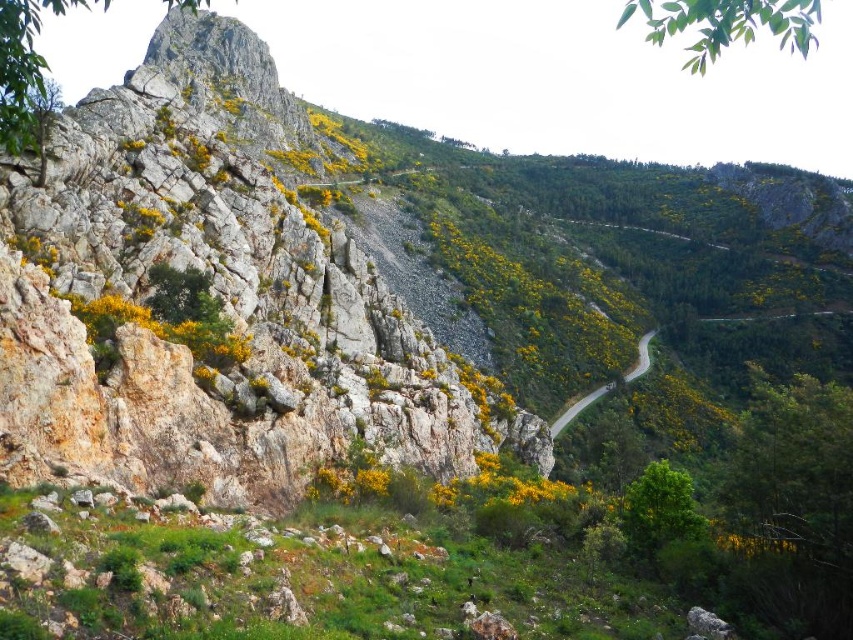
Question: Does rugged stone mountain at left have a smaller size compared to smooth asphalt road at center?

Choices:
 (A) no
 (B) yes

Answer: (A)

Question: Which point is closer to the camera?

Choices:
 (A) smooth asphalt road at center
 (B) rugged stone mountain at left

Answer: (B)

Question: Does rugged stone mountain at left lie in front of smooth asphalt road at center?

Choices:
 (A) no
 (B) yes

Answer: (B)

Question: Which of the following is the farthest from the observer?

Choices:
 (A) (250, 376)
 (B) (590, 403)

Answer: (B)

Question: Considering the relative positions of rugged stone mountain at left and smooth asphalt road at center in the image provided, where is rugged stone mountain at left located with respect to smooth asphalt road at center?

Choices:
 (A) above
 (B) below

Answer: (A)